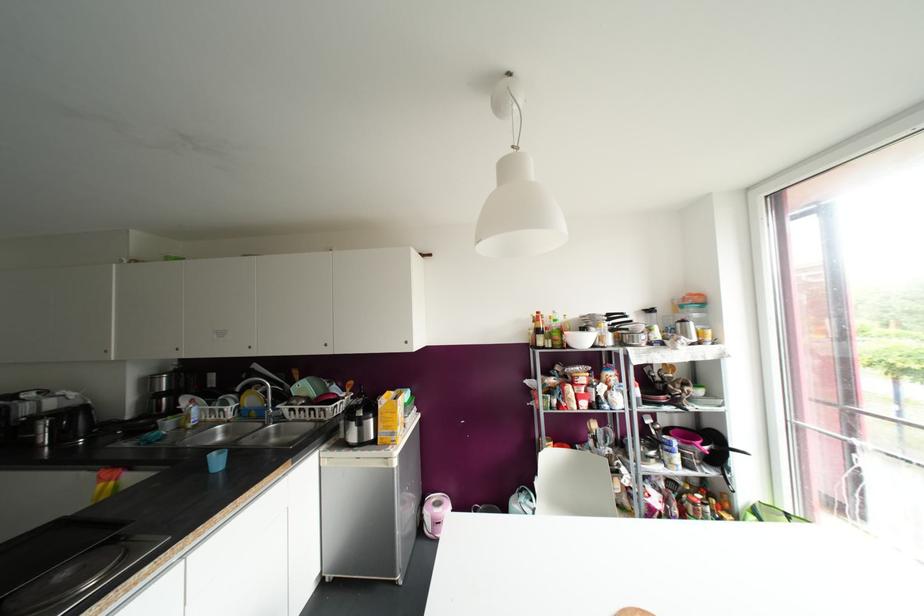
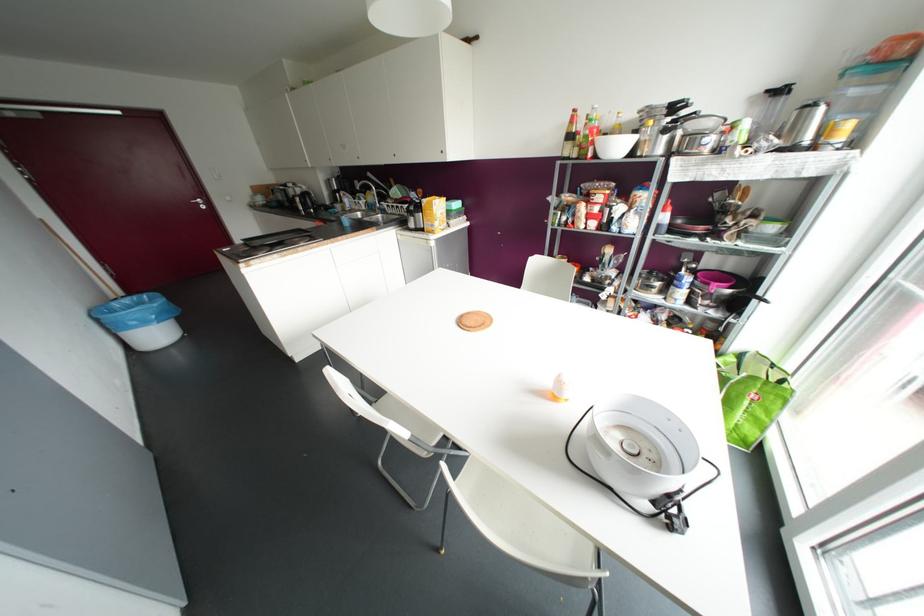
Locate, in the second image, the point that corresponds to the point at 786,515 in the first image.

(772, 365)